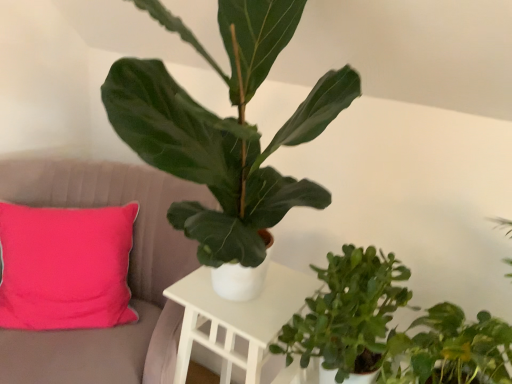
This screenshot has width=512, height=384. I want to click on green matte plant at center, which is the 2th houseplant in top-to-bottom order, so click(x=348, y=313).

Measure the distance between green matte plant at lower right, which is counted as the 3th houseplant, starting from the top, and camera.

89.50 centimeters.

Find the location of a particular element. The image size is (512, 384). green matte plant at center, the 1th houseplant from the top is located at coordinates (225, 136).

This screenshot has width=512, height=384. What do you see at coordinates (128, 275) in the screenshot?
I see `pink fabric cushion at left` at bounding box center [128, 275].

Locate an element on the screen. The image size is (512, 384). green matte plant at center, which is the 2th houseplant in top-to-bottom order is located at coordinates (348, 313).

Is green matte plant at center, positioned as the third houseplant in bottom-to-top order, behind white matte table at center?

No, green matte plant at center, positioned as the third houseplant in bottom-to-top order, is closer to the viewer.

Can you tell me how much green matte plant at center, the 1th houseplant from the top, and white matte table at center differ in facing direction?

There is a 1.04-degree angle between the facing directions of green matte plant at center, the 1th houseplant from the top, and white matte table at center.

From the image's perspective, which one is positioned lower, green matte plant at center, the 1th houseplant from the top, or white matte table at center?

From the image's view, white matte table at center is below.

Is green matte plant at center, positioned as the third houseplant in bottom-to-top order, bigger than white matte table at center?

Correct, green matte plant at center, positioned as the third houseplant in bottom-to-top order, is larger in size than white matte table at center.

Is the depth of green matte plant at center, the 1th houseplant from the top, less than that of green matte plant at center, acting as the second houseplant starting from the bottom?

Yes, the depth of green matte plant at center, the 1th houseplant from the top, is less than that of green matte plant at center, acting as the second houseplant starting from the bottom.

Is green matte plant at center, positioned as the third houseplant in bottom-to-top order, facing towards green matte plant at center, acting as the second houseplant starting from the bottom?

No, green matte plant at center, positioned as the third houseplant in bottom-to-top order, is not aimed at green matte plant at center, acting as the second houseplant starting from the bottom.

I want to click on the 1st houseplant positioned below the green matte plant at center, positioned as the third houseplant in bottom-to-top order (from a real-world perspective), so click(x=348, y=313).

Based on the photo, does white matte table at center appear on the right side of green matte plant at center, which is the 2th houseplant in top-to-bottom order?

In fact, white matte table at center is to the left of green matte plant at center, which is the 2th houseplant in top-to-bottom order.

Is there a large distance between white matte table at center and green matte plant at center, which is the 2th houseplant in top-to-bottom order?

No, white matte table at center is not far away from green matte plant at center, which is the 2th houseplant in top-to-bottom order.

Considering the relative sizes of pink fabric cushion at left and white matte table at center in the image provided, is pink fabric cushion at left thinner than white matte table at center?

Incorrect, the width of pink fabric cushion at left is not less than that of white matte table at center.

From a real-world perspective, which is physically above, pink fabric cushion at left or white matte table at center?

white matte table at center.

Is pink fabric cushion at left inside or outside of white matte table at center?

pink fabric cushion at left is not inside white matte table at center, it's outside.

Can we say pink fabric cushion at left lies outside green matte plant at center, which is the 2th houseplant in top-to-bottom order?

Yes, pink fabric cushion at left is located beyond the bounds of green matte plant at center, which is the 2th houseplant in top-to-bottom order.

What's the angular difference between pink fabric cushion at left and green matte plant at center, acting as the second houseplant starting from the bottom,'s facing directions?

They differ by 28.9 degrees in their facing directions.

Does pink fabric cushion at left lie in front of green matte plant at center, which is the 2th houseplant in top-to-bottom order?

No.

How distant is pink fabric cushion at left from green matte plant at center, acting as the second houseplant starting from the bottom?

A distance of 58.70 centimeters exists between pink fabric cushion at left and green matte plant at center, acting as the second houseplant starting from the bottom.

Is green matte plant at lower right, which is counted as the 3th houseplant, starting from the top, wider than white matte table at center?

Correct, the width of green matte plant at lower right, which is counted as the 3th houseplant, starting from the top, exceeds that of white matte table at center.

Which object is further away from the camera taking this photo, green matte plant at lower right, the 1th houseplant when ordered from bottom to top, or white matte table at center?

white matte table at center is further away from the camera.

Is point (438, 379) farther from viewer compared to point (193, 280)?

No, it is in front of (193, 280).

Which is correct: green matte plant at center, which is the 2th houseplant in top-to-bottom order, is inside green matte plant at center, positioned as the third houseplant in bottom-to-top order, or outside of it?

green matte plant at center, which is the 2th houseplant in top-to-bottom order, exists outside the volume of green matte plant at center, positioned as the third houseplant in bottom-to-top order.

Between green matte plant at center, acting as the second houseplant starting from the bottom, and green matte plant at center, the 1th houseplant from the top, which one has less height?

green matte plant at center, acting as the second houseplant starting from the bottom.

This screenshot has width=512, height=384. Find the location of `the 2nd houseplant behind when counting from the green matte plant at center, the 1th houseplant from the top`. the 2nd houseplant behind when counting from the green matte plant at center, the 1th houseplant from the top is located at coordinates (348, 313).

Where is `the 3rd houseplant above the white matte table at center (from the image's perspective)`? the 3rd houseplant above the white matte table at center (from the image's perspective) is located at coordinates (225, 136).

At what (x,y) coordinates should I click in order to perform the action: click on the 2nd houseplant in front of the green matte plant at center, acting as the second houseplant starting from the bottom, starting your count from the anchor. Please return your answer as a coordinate pair (x, y). The height and width of the screenshot is (384, 512). Looking at the image, I should click on (225, 136).

Based on the photo, considering their positions, is white matte table at center positioned closer to green matte plant at center, positioned as the third houseplant in bottom-to-top order, than pink fabric cushion at left?

white matte table at center lies closer to green matte plant at center, positioned as the third houseplant in bottom-to-top order, than the other object.

Looking at the image, which one is located closer to green matte plant at lower right, the 1th houseplant when ordered from bottom to top, white matte table at center or green matte plant at center, acting as the second houseplant starting from the bottom?

Based on the image, green matte plant at center, acting as the second houseplant starting from the bottom, appears to be nearer to green matte plant at lower right, the 1th houseplant when ordered from bottom to top.

Estimate the real-world distances between objects in this image. Which object is further from pink fabric cushion at left, white matte table at center or green matte plant at lower right, which is counted as the 3th houseplant, starting from the top?

Based on the image, green matte plant at lower right, which is counted as the 3th houseplant, starting from the top, appears to be further to pink fabric cushion at left.

When comparing their distances from green matte plant at lower right, which is counted as the 3th houseplant, starting from the top, does pink fabric cushion at left or white matte table at center seem closer?

white matte table at center is positioned closer to the anchor green matte plant at lower right, which is counted as the 3th houseplant, starting from the top.

From the image, which object appears to be farther from green matte plant at center, positioned as the third houseplant in bottom-to-top order, pink fabric cushion at left or green matte plant at lower right, which is counted as the 3th houseplant, starting from the top?

The object further to green matte plant at center, positioned as the third houseplant in bottom-to-top order, is pink fabric cushion at left.

Considering their positions, is green matte plant at center, the 1th houseplant from the top, positioned closer to pink fabric cushion at left than green matte plant at center, which is the 2th houseplant in top-to-bottom order?

Among the two, green matte plant at center, the 1th houseplant from the top, is located nearer to pink fabric cushion at left.

Based on their spatial positions, is green matte plant at center, positioned as the third houseplant in bottom-to-top order, or pink fabric cushion at left further from white matte table at center?

green matte plant at center, positioned as the third houseplant in bottom-to-top order, lies further to white matte table at center than the other object.

From the image, which object appears to be nearer to pink fabric cushion at left, green matte plant at center, acting as the second houseplant starting from the bottom, or white matte table at center?

white matte table at center is positioned closer to the anchor pink fabric cushion at left.

Find the location of a particular element. This screenshot has width=512, height=384. table situated between pink fabric cushion at left and green matte plant at center, the 1th houseplant from the top, from left to right is located at coordinates (237, 319).

Where is `table between pink fabric cushion at left and green matte plant at center, which is the 2th houseplant in top-to-bottom order, from left to right`? The image size is (512, 384). table between pink fabric cushion at left and green matte plant at center, which is the 2th houseplant in top-to-bottom order, from left to right is located at coordinates (237, 319).

Find the location of a particular element. houseplant between green matte plant at center, the 1th houseplant from the top, and green matte plant at lower right, which is counted as the 3th houseplant, starting from the top, in the up-down direction is located at coordinates (348, 313).

This screenshot has width=512, height=384. I want to click on houseplant between pink fabric cushion at left and green matte plant at center, which is the 2th houseplant in top-to-bottom order, from left to right, so click(x=225, y=136).